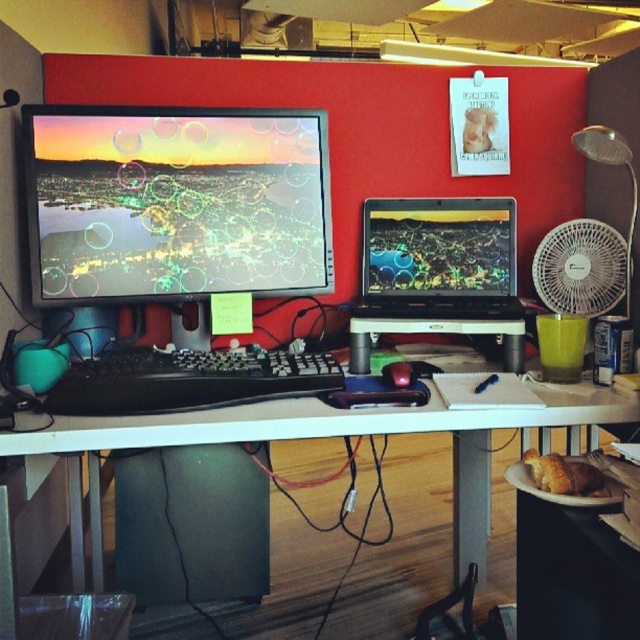
Question: Does white plastic computer desk at center have a larger size compared to matte black laptop at center?

Choices:
 (A) yes
 (B) no

Answer: (A)

Question: Can you confirm if white plastic computer desk at center is positioned below black matte keyboard at center?

Choices:
 (A) no
 (B) yes

Answer: (B)

Question: Which of the following is the farthest from the observer?

Choices:
 (A) (602, 282)
 (B) (504, 428)
 (C) (243, 358)

Answer: (A)

Question: Based on their relative distances, which object is nearer to the white plastic fan at right?

Choices:
 (A) matte black laptop at center
 (B) matte black monitor at center

Answer: (A)

Question: Considering the relative positions of white plastic computer desk at center and black matte keyboard at center in the image provided, where is white plastic computer desk at center located with respect to black matte keyboard at center?

Choices:
 (A) left
 (B) right

Answer: (B)

Question: Which point is closer to the camera taking this photo?

Choices:
 (A) (186, 387)
 (B) (618, 280)
 (C) (397, 369)
 (D) (44, 132)

Answer: (A)